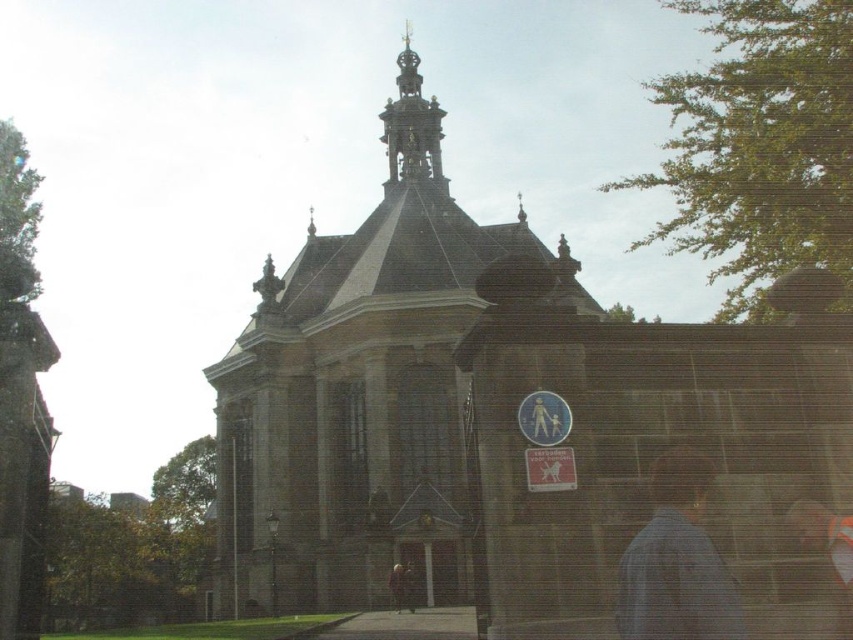
A tourist wearing a blue denim jacket at lower right is standing at the entrance of the historic building. The tour guide is standing at the base of the central dome. How far apart are they?

The blue denim jacket at lower right and the tour guide are 81.93 meters apart.

You are standing in front of the historic building and want to take a photo that includes both point (662,468) and point (392,156). Which point should you focus on first to ensure both are in focus?

You should focus on point (392,156) first because it is farther from the camera than point (662,468). This way, the depth of field will cover both points effectively.